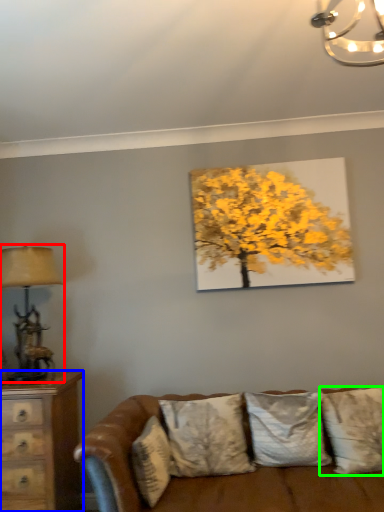
Question: Which is nearer to the table lamp (highlighted by a red box)? chest of drawers (highlighted by a blue box) or pillow (highlighted by a green box).

Choices:
 (A) chest of drawers
 (B) pillow

Answer: (A)